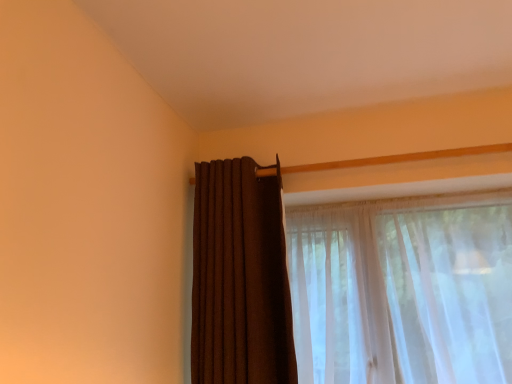
The image size is (512, 384). Identify the location of brown textured curtain at upper right. (240, 277).

The image size is (512, 384). What do you see at coordinates (240, 277) in the screenshot? I see `brown textured curtain at upper right` at bounding box center [240, 277].

This screenshot has width=512, height=384. Find the location of `brown textured curtain at upper right`. brown textured curtain at upper right is located at coordinates (240, 277).